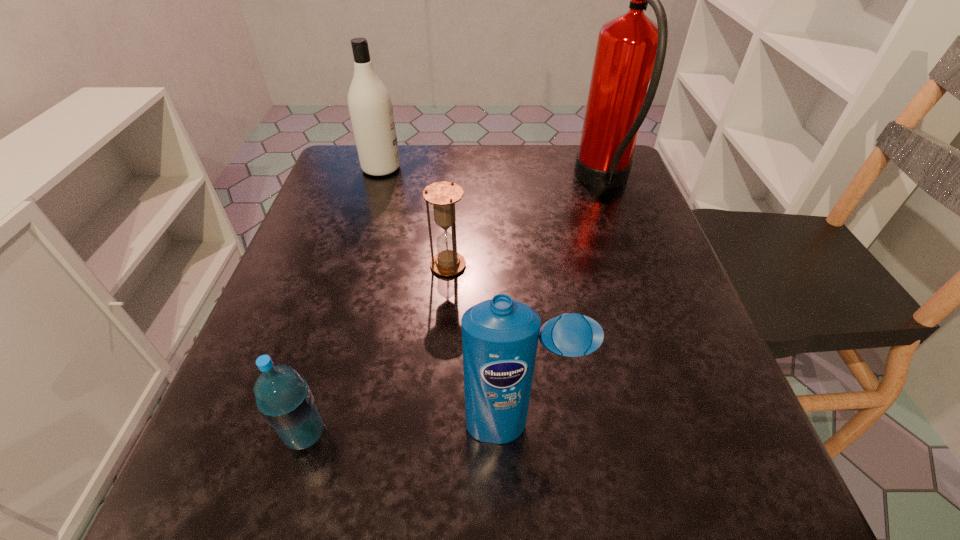
Locate an element on the screen. Image resolution: width=960 pixels, height=540 pixels. free space that satisfies the following two spatial constraints: 1. on the back side of the water bottle; 2. on the right side of the tallest object is located at coordinates (379, 181).

The height and width of the screenshot is (540, 960). In order to click on vacant space that satisfies the following two spatial constraints: 1. on the front side of the third object from left to right; 2. on the left side of the fourth object from left to right in this screenshot , I will do `click(436, 426)`.

Find the location of `vacant area that satisfies the following two spatial constraints: 1. on the front-facing side of the third object from left to right; 2. on the left side of the farther shampoo`. vacant area that satisfies the following two spatial constraints: 1. on the front-facing side of the third object from left to right; 2. on the left side of the farther shampoo is located at coordinates click(x=352, y=265).

The image size is (960, 540). What are the coordinates of `free space that satisfies the following two spatial constraints: 1. on the front-facing side of the left shampoo; 2. on the right side of the hourglass` in the screenshot? It's located at (352, 265).

Locate an element on the screen. blank space that satisfies the following two spatial constraints: 1. on the back side of the water bottle; 2. on the left side of the hourglass is located at coordinates (354, 265).

Find the location of a particular element. The height and width of the screenshot is (540, 960). vacant region that satisfies the following two spatial constraints: 1. on the front-facing side of the rightmost object; 2. on the right side of the farther shampoo is located at coordinates (377, 181).

This screenshot has height=540, width=960. I want to click on vacant region that satisfies the following two spatial constraints: 1. on the front-facing side of the farther shampoo; 2. on the back side of the right shampoo, so click(304, 426).

Identify the location of vacant point that satisfies the following two spatial constraints: 1. on the front-facing side of the left shampoo; 2. on the right side of the water bottle. (302, 434).